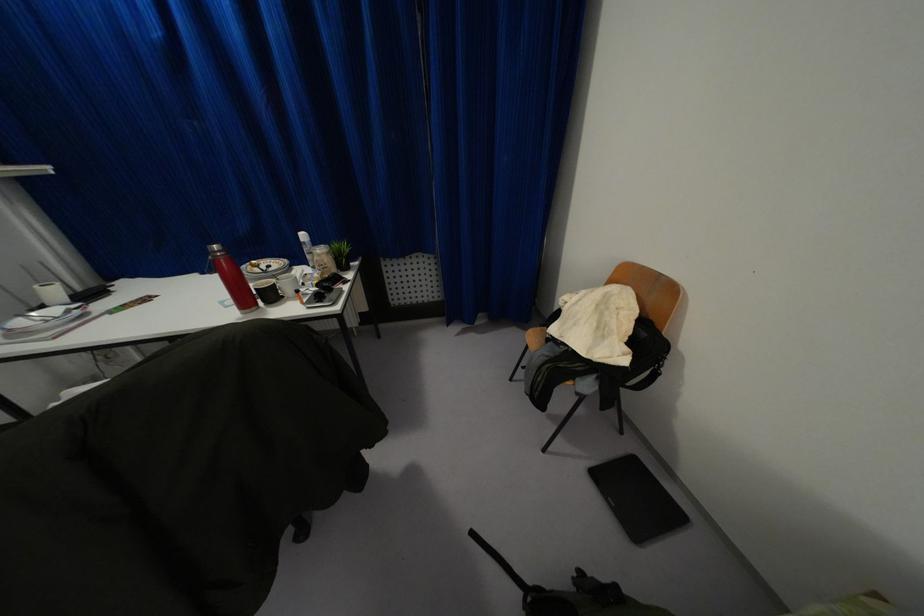
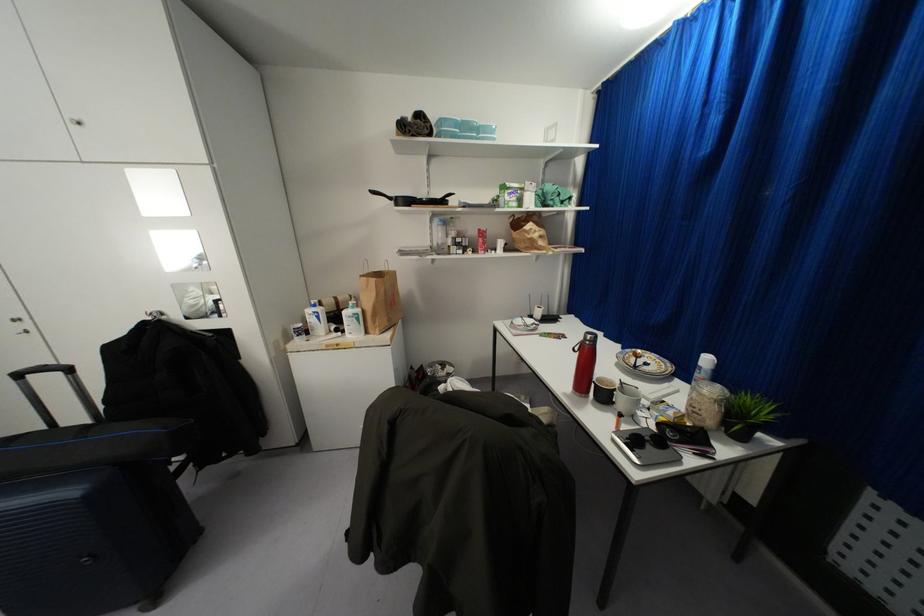
First-person continuous shooting, in which direction is the camera rotating?

The rotation direction of the camera is left-down.